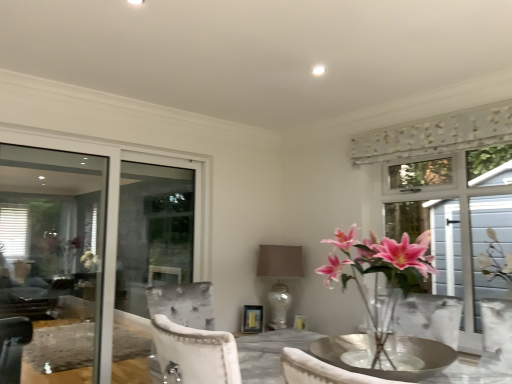
Question: From a real-world perspective, is floral fabric curtain at upper right positioned above or below pink glass vase at center right?

Choices:
 (A) above
 (B) below

Answer: (A)

Question: Considering the relative positions of floral fabric curtain at upper right and pink glass vase at center right in the image provided, is floral fabric curtain at upper right to the left or to the right of pink glass vase at center right?

Choices:
 (A) left
 (B) right

Answer: (B)

Question: Which object is positioned closest to the pink glass vase at center right?

Choices:
 (A) satin beige lampshade at center
 (B) floral fabric curtain at upper right
 (C) clear glass window at left
 (D) white textured screen at right

Answer: (D)

Question: Based on their relative distances, which object is nearer to the floral fabric curtain at upper right?

Choices:
 (A) satin beige lampshade at center
 (B) white textured screen at right
 (C) clear glass window at left
 (D) pink glass vase at center right

Answer: (B)